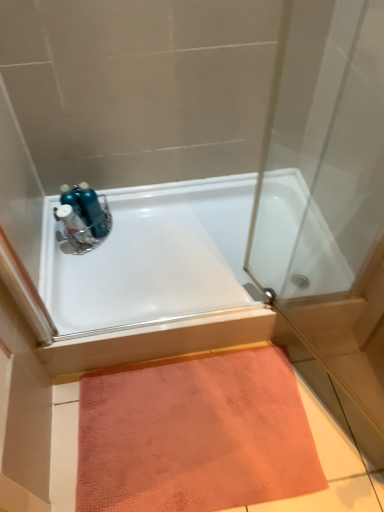
Image resolution: width=384 pixels, height=512 pixels. I want to click on free space in front of metallic blue sink at upper left, so click(84, 274).